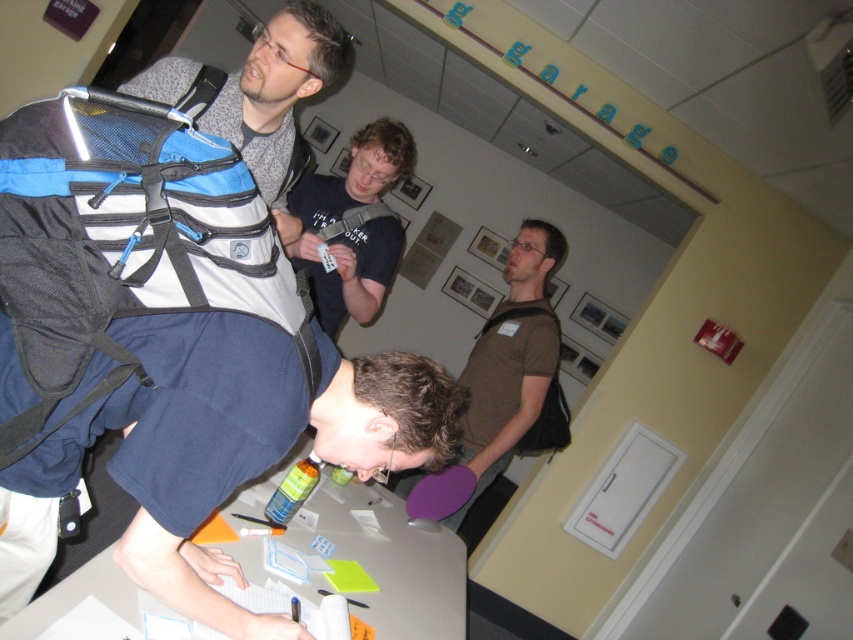
You are organizing a storage space and need to place the blue and white mesh backpack at left and the brown matte shirt at center into a small compartment. Which item should you place first to maximize space efficiency?

You should place the blue and white mesh backpack at left first because it occupies less space than the brown matte shirt at center, allowing the larger item to be placed afterward without overcrowding the compartment.

You are standing in the room and want to place a 1.5 meter long object between the blue and white mesh backpack at left and the brown matte shirt at center. Is there enough space?

The blue and white mesh backpack at left is 1.65 meters from the brown matte shirt at center, so yes, there is enough space to place a 1.5 meter long object between them.

You are standing in the room and want to reach the blue and white mesh backpack at left without moving your feet. Can you do it?

The blue and white mesh backpack at left is 38.23 inches away from camera, so if you can reach 38.23 inches without moving your feet, you can reach it. However, typical human reaching distance is about 29 inches, so you might not be able to reach it without moving.